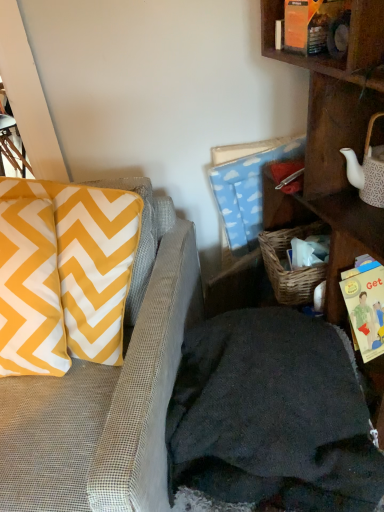
Find the location of a particular element. The width and height of the screenshot is (384, 512). wooden shelf at right is located at coordinates (334, 143).

Describe the element at coordinates (90, 260) in the screenshot. I see `yellow/white chevron pillow at left` at that location.

This screenshot has height=512, width=384. I want to click on textured gray couch at left, so pyautogui.click(x=108, y=390).

From the image's perspective, is yellow/white chevron pillow at left positioned above or below yellow paper book at right?

yellow/white chevron pillow at left is above yellow paper book at right.

From a real-world perspective, is yellow/white chevron pillow at left positioned above or below yellow paper book at right?

yellow/white chevron pillow at left is situated higher than yellow paper book at right in the real world.

Could you tell me if yellow/white chevron pillow at left is facing yellow paper book at right?

No, yellow/white chevron pillow at left is not oriented towards yellow paper book at right.

What are the coordinates of `pillow in front of the yellow paper book at right` in the screenshot? It's located at (90, 260).

Does point (42, 503) come farther from viewer compared to point (381, 221)?

No, (42, 503) is in front of (381, 221).

Visually, is textured gray couch at left positioned to the left or to the right of wooden shelf at right?

textured gray couch at left is positioned on wooden shelf at right's left side.

Can you confirm if textured gray couch at left is smaller than wooden shelf at right?

No, textured gray couch at left is not smaller than wooden shelf at right.

Does textured gray couch at left turn towards wooden shelf at right?

No.

Would you say wooden shelf at right is inside or outside textured gray couch at left?

The correct answer is: outside.

From a real-world perspective, which is physically below, wooden shelf at right or textured gray couch at left?

In real-world perspective, textured gray couch at left is lower.

Consider the image. Is wooden shelf at right taller than textured gray couch at left?

Yes.

Is the surface of wooden shelf at right in direct contact with textured gray couch at left?

There is a gap between wooden shelf at right and textured gray couch at left.

Measure the distance between yellow/white chevron pillow at left and textured gray couch at left.

yellow/white chevron pillow at left and textured gray couch at left are 5.85 inches apart.

From their relative heights in the image, would you say yellow/white chevron pillow at left is taller or shorter than textured gray couch at left?

Considering their sizes, yellow/white chevron pillow at left has less height than textured gray couch at left.

The image size is (384, 512). Find the location of `studio couch below the yellow/white chevron pillow at left (from a real-world perspective)`. studio couch below the yellow/white chevron pillow at left (from a real-world perspective) is located at coordinates (108, 390).

Choose the correct answer: Is yellow/white chevron pillow at left inside textured gray couch at left or outside it?

yellow/white chevron pillow at left is inside textured gray couch at left.

Considering the sizes of objects textured gray couch at left and yellow/white chevron pillow at left in the image provided, who is taller, textured gray couch at left or yellow/white chevron pillow at left?

Standing taller between the two is textured gray couch at left.

Is textured gray couch at left positioned behind yellow/white chevron pillow at left?

No, it is not.

Is textured gray couch at left at the left side of yellow/white chevron pillow at left?

Yes, textured gray couch at left is to the left of yellow/white chevron pillow at left.

Can we say textured gray couch at left lies outside yellow/white chevron pillow at left?

textured gray couch at left is positioned outside yellow/white chevron pillow at left.

In terms of height, does yellow paper book at right look taller or shorter compared to wooden shelf at right?

Clearly, yellow paper book at right is shorter compared to wooden shelf at right.

Is yellow paper book at right to the right of wooden shelf at right from the viewer's perspective?

Incorrect, yellow paper book at right is not on the right side of wooden shelf at right.

Where is `shelf above the yellow paper book at right (from a real-world perspective)`? shelf above the yellow paper book at right (from a real-world perspective) is located at coordinates (334, 143).

Is yellow paper book at right far from wooden shelf at right?

yellow paper book at right is near wooden shelf at right, not far away.

Find the location of `studio couch on the left of yellow paper book at right`. studio couch on the left of yellow paper book at right is located at coordinates (108, 390).

Is point (375, 309) behind point (121, 432)?

Yes, point (375, 309) is behind point (121, 432).

Could you tell me if yellow paper book at right is turned towards textured gray couch at left?

Yes, yellow paper book at right faces towards textured gray couch at left.

In the image, is yellow paper book at right positioned in front of or behind textured gray couch at left?

yellow paper book at right is positioned farther from the viewer than textured gray couch at left.

In the image, there is a yellow/white chevron pillow at left. At what (x,y) coordinates should I click in order to perform the action: click on book below it (from a real-world perspective). Please return your answer as a coordinate pair (x, y). Looking at the image, I should click on (365, 307).

This screenshot has width=384, height=512. I want to click on studio couch that is below the wooden shelf at right (from the image's perspective), so click(x=108, y=390).

Looking at the image, which one is located further to textured gray couch at left, yellow/white chevron pillow at left or wooden shelf at right?

wooden shelf at right lies further to textured gray couch at left than the other object.

When comparing their distances from yellow paper book at right, does textured gray couch at left or yellow/white chevron pillow at left seem further?

yellow/white chevron pillow at left lies further to yellow paper book at right than the other object.

Considering their positions, is textured gray couch at left positioned further to yellow/white chevron pillow at left than wooden shelf at right?

wooden shelf at right is further to yellow/white chevron pillow at left.

Which object lies nearer to the anchor point textured gray couch at left, yellow paper book at right or yellow/white chevron pillow at left?

yellow/white chevron pillow at left is positioned closer to the anchor textured gray couch at left.

Estimate the real-world distances between objects in this image. Which object is closer to yellow/white chevron pillow at left, wooden shelf at right or textured gray couch at left?

textured gray couch at left is positioned closer to the anchor yellow/white chevron pillow at left.

Estimate the real-world distances between objects in this image. Which object is further from yellow/white chevron pillow at left, wooden shelf at right or yellow paper book at right?

The object further to yellow/white chevron pillow at left is yellow paper book at right.

When comparing their distances from wooden shelf at right, does yellow paper book at right or yellow/white chevron pillow at left seem further?

The object further to wooden shelf at right is yellow/white chevron pillow at left.

Looking at the image, which one is located further to yellow paper book at right, wooden shelf at right or yellow/white chevron pillow at left?

yellow/white chevron pillow at left is positioned further to the anchor yellow paper book at right.

Image resolution: width=384 pixels, height=512 pixels. Identify the location of book between textured gray couch at left and wooden shelf at right. (365, 307).

At what (x,y) coordinates should I click in order to perform the action: click on book between yellow/white chevron pillow at left and wooden shelf at right in the horizontal direction. Please return your answer as a coordinate pair (x, y). Image resolution: width=384 pixels, height=512 pixels. Looking at the image, I should click on (365, 307).

Locate an element on the screen. The height and width of the screenshot is (512, 384). pillow between textured gray couch at left and yellow paper book at right in the horizontal direction is located at coordinates (90, 260).

Locate an element on the screen. This screenshot has width=384, height=512. pillow between textured gray couch at left and wooden shelf at right from left to right is located at coordinates (90, 260).